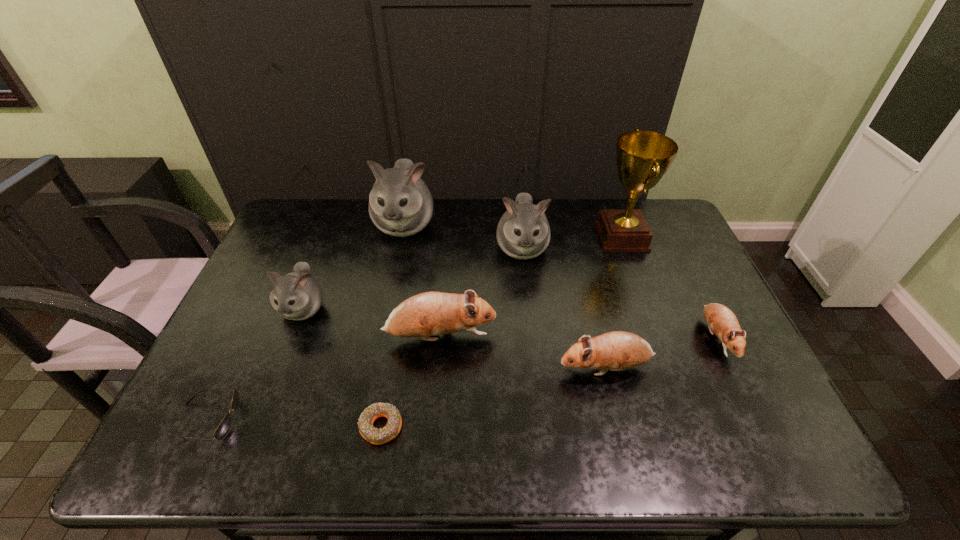
Where is `award`? The image size is (960, 540). award is located at coordinates (643, 157).

Locate an element on the screen. The image size is (960, 540). gold award is located at coordinates (643, 157).

Locate an element on the screen. The width and height of the screenshot is (960, 540). the second tallest object is located at coordinates (400, 204).

Locate an element on the screen. The image size is (960, 540). the tallest hamster is located at coordinates (400, 204).

You are a GUI agent. You are given a task and a screenshot of the screen. Output one action in this format:
    pyautogui.click(x=<x>, y=<y>)
    Task: Click on the rightmost white hamster
    
    Given the screenshot: What is the action you would take?
    pyautogui.click(x=523, y=232)

At what (x,y) coordinates should I click in order to perform the action: click on the second tallest hamster. Please return your answer as a coordinate pair (x, y). Image resolution: width=960 pixels, height=540 pixels. Looking at the image, I should click on (523, 232).

Where is `the leftmost hamster`? The height and width of the screenshot is (540, 960). the leftmost hamster is located at coordinates (296, 296).

Image resolution: width=960 pixels, height=540 pixels. Identify the location of the smallest white hamster. (296, 296).

Identify the location of the leftmost brown hamster. The height and width of the screenshot is (540, 960). (426, 314).

I want to click on the sixth tallest object, so click(618, 350).